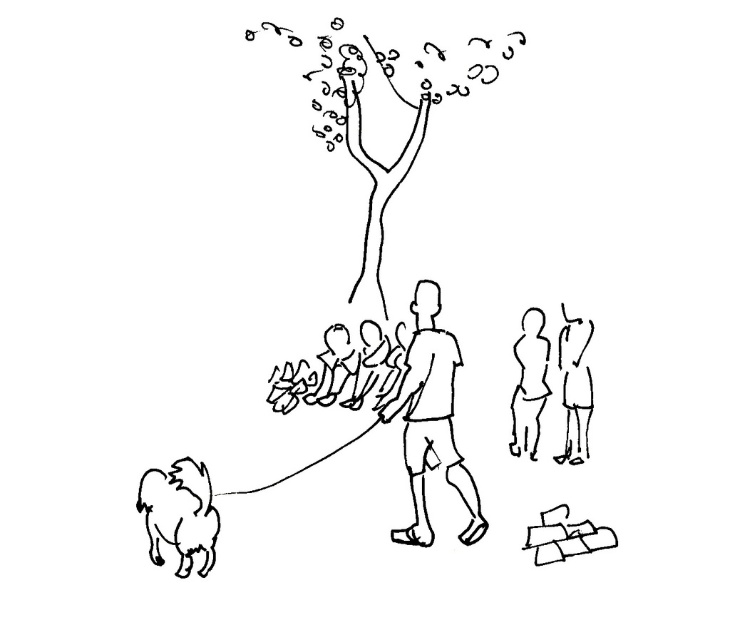
Question: Which object is the closest to the white fluffy dog at lower left?

Choices:
 (A) smooth skin figure at right
 (B) smooth skin figure at center
 (C) smooth black tree at upper center

Answer: (B)

Question: Observing the image, what is the correct spatial positioning of smooth black tree at upper center in reference to smooth skin figure at right?

Choices:
 (A) right
 (B) left

Answer: (B)

Question: Based on their relative distances, which object is nearer to the smooth skin figure at center?

Choices:
 (A) smooth skin child at right
 (B) white fluffy dog at lower left

Answer: (A)

Question: Based on their relative distances, which object is nearer to the smooth skin child at right?

Choices:
 (A) smooth black tree at upper center
 (B) smooth skin figure at center

Answer: (B)

Question: In this image, where is white fluffy dog at lower left located relative to smooth skin child at right?

Choices:
 (A) above
 (B) below

Answer: (B)

Question: Is the position of white fluffy dog at lower left less distant than that of smooth skin child at right?

Choices:
 (A) no
 (B) yes

Answer: (B)